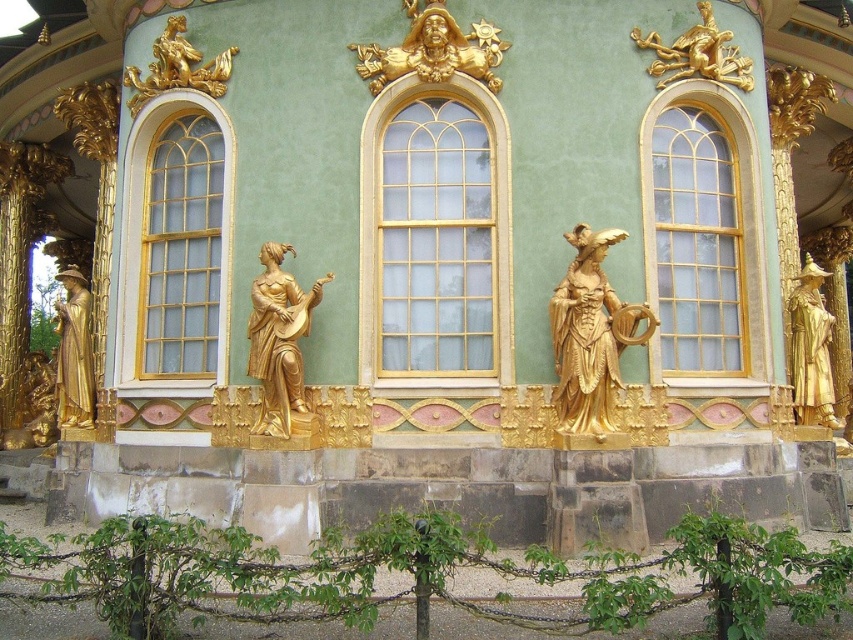
From the picture: Does gold/gilded statue at center have a lesser width compared to gold polished statue at right?

Yes, gold/gilded statue at center is thinner than gold polished statue at right.

Locate an element on the screen. gold/gilded statue at center is located at coordinates (590, 336).

The width and height of the screenshot is (853, 640). Find the location of `gold/gilded statue at center`. gold/gilded statue at center is located at coordinates (590, 336).

Find the location of a particular element. The image size is (853, 640). gold/gilded statue at center is located at coordinates (590, 336).

Does clear glass window at center appear on the left side of clear glass window at center right?

Indeed, clear glass window at center is positioned on the left side of clear glass window at center right.

Does clear glass window at center have a larger size compared to clear glass window at center right?

No, clear glass window at center is not bigger than clear glass window at center right.

Which is behind, point (364, 234) or point (699, 321)?

The point (699, 321) is behind.

Identify the location of clear glass window at center. This screenshot has width=853, height=640. (433, 236).

Does gold polished wood statue at center have a greater width compared to gold/gilded/ornate figure at upper center?

Incorrect, gold polished wood statue at center's width does not surpass gold/gilded/ornate figure at upper center's.

This screenshot has width=853, height=640. I want to click on gold polished wood statue at center, so pyautogui.click(x=280, y=342).

You are a GUI agent. You are given a task and a screenshot of the screen. Output one action in this format:
    pyautogui.click(x=<x>, y=<y>)
    Task: Click on the gold polished wood statue at center
    The image size is (853, 640).
    Given the screenshot: What is the action you would take?
    pyautogui.click(x=280, y=342)